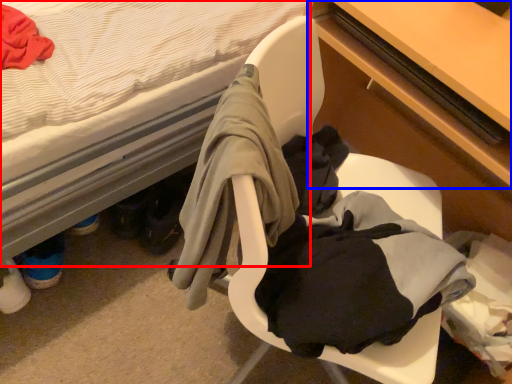
Question: Which object is closer to the camera taking this photo, bed (highlighted by a red box) or table (highlighted by a blue box)?

Choices:
 (A) bed
 (B) table

Answer: (A)